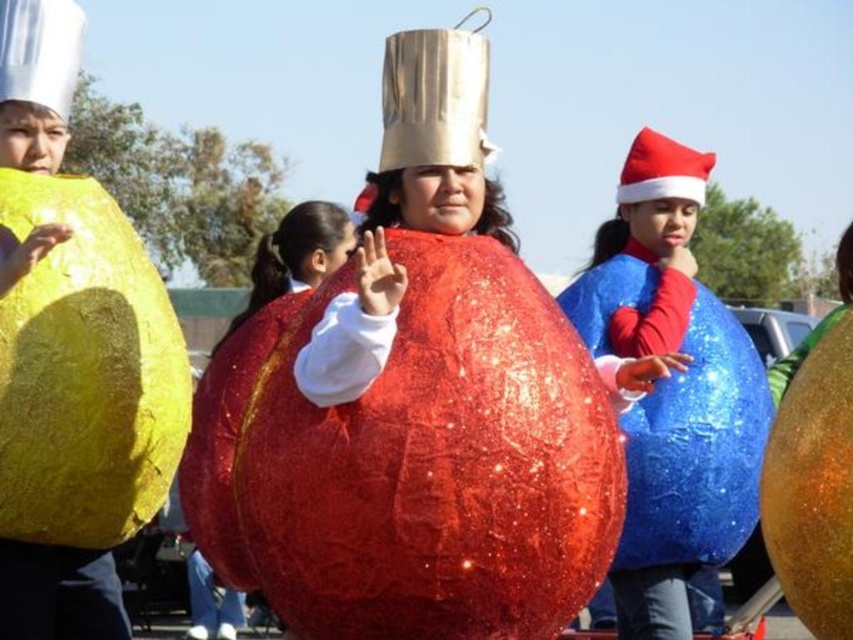
You are organizing a Christmas party and need to decide where to place decorations. The blue sparkly balloon at right and the white paper christmas hat at upper left are both part of your decorations. Which decoration is smaller in size?

The blue sparkly balloon at right is smaller than the white paper christmas hat at upper left.

You are a photographer trying to capture the best angle of the two points in the scene. Which point, point (392, 148) or point (30, 36), is closer to the camera?

Point (392, 148) is further to the camera than point (30, 36), so the closer point to the camera is point (30, 36).

You are standing at the point labeled as point (x=434, y=634) in the image. You want to throw a water balloon to a friend who is standing where the viewer is positioned. If the water balloon can travel 40 feet before hitting the ground, will it reach your friend?

The distance between point (x=434, y=634) and the viewer is 38.58 feet, which is less than the 40 feet the water balloon can travel. Therefore, the water balloon will reach your friend.